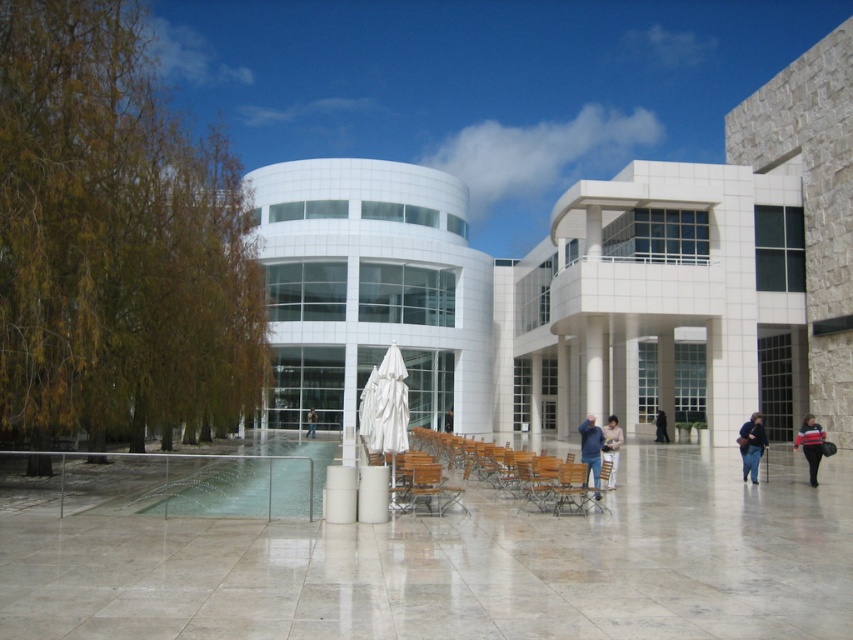
Question: Does black leather jacket at lower right have a greater width compared to light brown leather jacket at center?

Choices:
 (A) no
 (B) yes

Answer: (B)

Question: Is blue denim jacket at center closer to camera compared to dark blue sweater at lower right?

Choices:
 (A) no
 (B) yes

Answer: (B)

Question: Which of the following is the closest to the observer?

Choices:
 (A) click(x=598, y=484)
 (B) click(x=612, y=419)
 (C) click(x=445, y=413)
 (D) click(x=659, y=410)

Answer: (A)

Question: Which point is farther from the camera taking this photo?

Choices:
 (A) (386, 410)
 (B) (451, 420)
 (C) (488, 483)
 (D) (312, 420)

Answer: (B)

Question: Does white fabric umbrella at center appear on the left side of dark blue sweater at lower right?

Choices:
 (A) yes
 (B) no

Answer: (A)

Question: Which object is closer to the camera taking this photo?

Choices:
 (A) dark blue sweater at lower right
 (B) blue denim jacket at center
 (C) white fabric umbrella at center

Answer: (B)